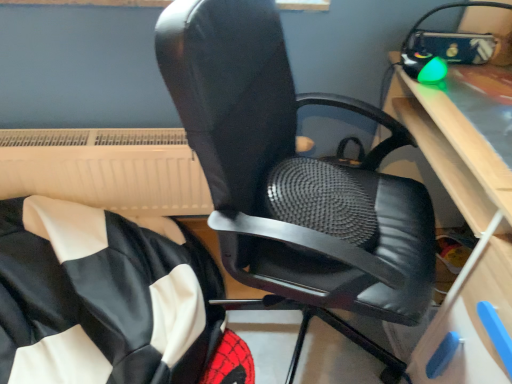
Question: Can you confirm if white plastic radiator at upper left is wider than light wood computer desk at right?

Choices:
 (A) no
 (B) yes

Answer: (A)

Question: Is white plastic radiator at upper left positioned with its back to light wood computer desk at right?

Choices:
 (A) no
 (B) yes

Answer: (A)

Question: Is white plastic radiator at upper left in contact with light wood computer desk at right?

Choices:
 (A) yes
 (B) no

Answer: (B)

Question: From a real-world perspective, is white plastic radiator at upper left located higher than light wood computer desk at right?

Choices:
 (A) yes
 (B) no

Answer: (B)

Question: Is white plastic radiator at upper left behind light wood computer desk at right?

Choices:
 (A) no
 (B) yes

Answer: (B)

Question: Considering the positions of light wood computer desk at right and white plastic radiator at upper left in the image, is light wood computer desk at right wider or thinner than white plastic radiator at upper left?

Choices:
 (A) thin
 (B) wide

Answer: (B)

Question: In terms of size, does light wood computer desk at right appear bigger or smaller than white plastic radiator at upper left?

Choices:
 (A) big
 (B) small

Answer: (A)

Question: Considering their positions, is light wood computer desk at right located in front of or behind white plastic radiator at upper left?

Choices:
 (A) front
 (B) behind

Answer: (A)

Question: Is light wood computer desk at right taller or shorter than white plastic radiator at upper left?

Choices:
 (A) tall
 (B) short

Answer: (A)

Question: Visually, is light wood computer desk at right positioned to the left or to the right of black leather chair at center?

Choices:
 (A) right
 (B) left

Answer: (A)

Question: From the image's perspective, relative to black leather chair at center, is light wood computer desk at right above or below?

Choices:
 (A) below
 (B) above

Answer: (B)

Question: Considering the positions of light wood computer desk at right and black leather chair at center in the image, is light wood computer desk at right taller or shorter than black leather chair at center?

Choices:
 (A) tall
 (B) short

Answer: (A)

Question: Is light wood computer desk at right wider or thinner than black leather chair at center?

Choices:
 (A) wide
 (B) thin

Answer: (B)

Question: Considering the positions of point (48, 160) and point (205, 21), is point (48, 160) closer or farther from the camera than point (205, 21)?

Choices:
 (A) farther
 (B) closer

Answer: (A)

Question: From the image's perspective, is white plastic radiator at upper left located above or below black leather chair at center?

Choices:
 (A) above
 (B) below

Answer: (A)